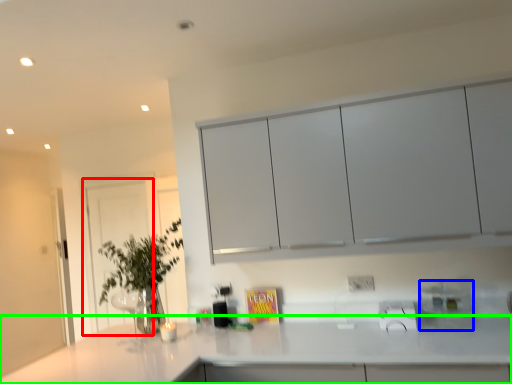
Question: Which is farther away from glass door (highlighted by a red box)? appliance (highlighted by a blue box) or countertop (highlighted by a green box)?

Choices:
 (A) appliance
 (B) countertop

Answer: (A)